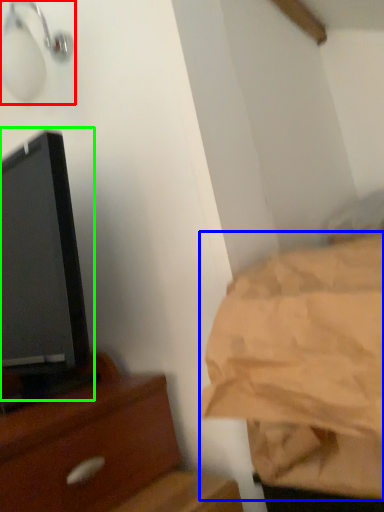
Question: Estimate the real-world distances between objects in this image. Which object is closer to light fixture (highlighted by a red box), sheet (highlighted by a blue box) or tv show (highlighted by a green box)?

Choices:
 (A) sheet
 (B) tv show

Answer: (B)